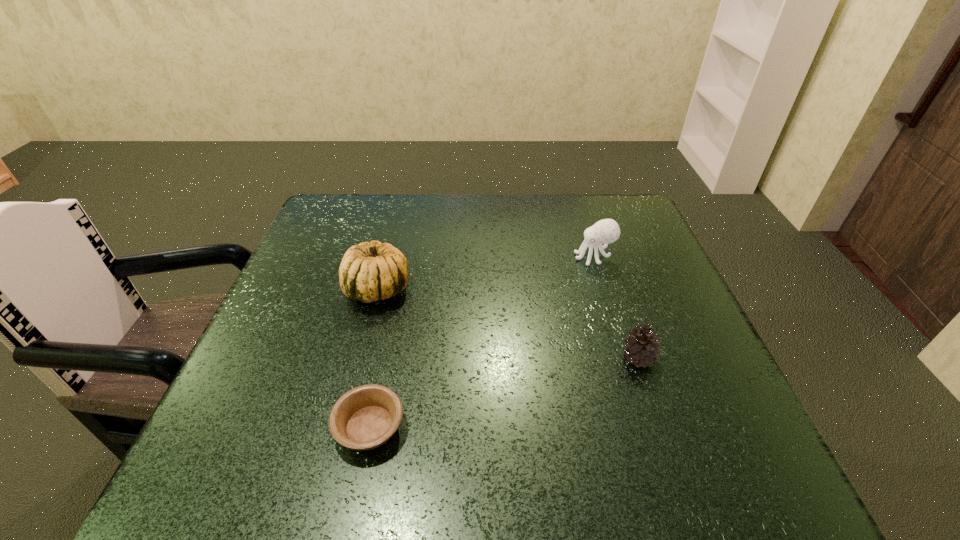
This screenshot has width=960, height=540. Identify the location of the third nearest object. (369, 272).

Locate an element on the screen. This screenshot has height=540, width=960. the farthest object is located at coordinates (606, 231).

Locate an element on the screen. The image size is (960, 540). pinecone is located at coordinates 643,348.

This screenshot has height=540, width=960. In order to click on the third tallest object in this screenshot , I will do `click(643, 348)`.

At what (x,y) coordinates should I click in order to perform the action: click on the shortest object. Please return your answer as a coordinate pair (x, y). Looking at the image, I should click on (365, 417).

The width and height of the screenshot is (960, 540). Identify the location of the nearest object. (365, 417).

You are a GUI agent. You are given a task and a screenshot of the screen. Output one action in this format:
    pyautogui.click(x=<x>, y=<y>)
    Task: Click on the vacant area situated on the back of the gourd
    Image resolution: width=960 pixels, height=540 pixels.
    Given the screenshot: What is the action you would take?
    pyautogui.click(x=393, y=231)

The height and width of the screenshot is (540, 960). Identify the location of free space located on the front-facing side of the farthest object. (455, 257).

The image size is (960, 540). Identify the location of blank area located on the front-facing side of the farthest object. (455, 257).

Image resolution: width=960 pixels, height=540 pixels. What are the coordinates of `free spot located on the front-facing side of the farthest object` in the screenshot? It's located at (555, 257).